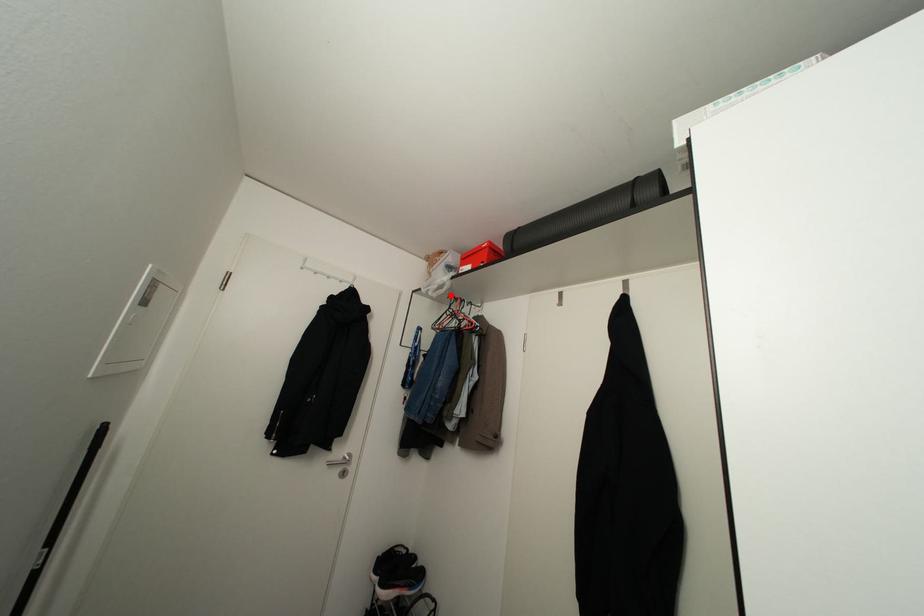
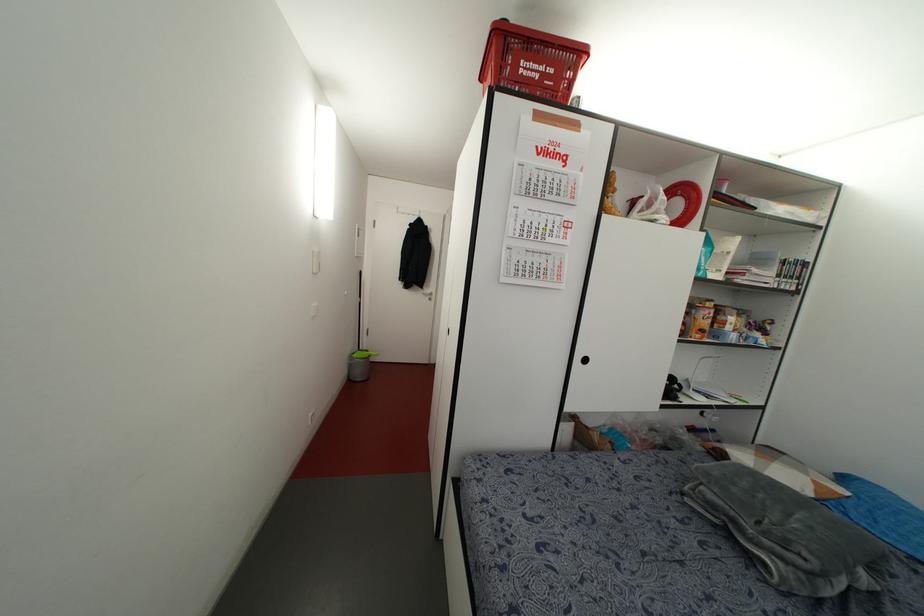
Question: I am providing you with two images of the same scene from different viewpoints. A red point is marked on the first image. At the location where the point appears in image 1, is it still visible in image 2?

Choices:
 (A) Yes
 (B) No

Answer: (B)